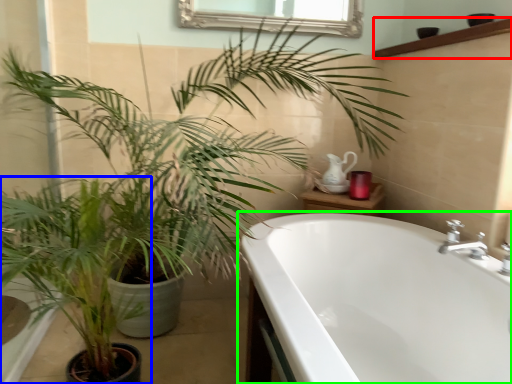
Question: Which is nearer to the balustrade (highlighted by a red box)? houseplant (highlighted by a blue box) or bathtub (highlighted by a green box).

Choices:
 (A) houseplant
 (B) bathtub

Answer: (B)